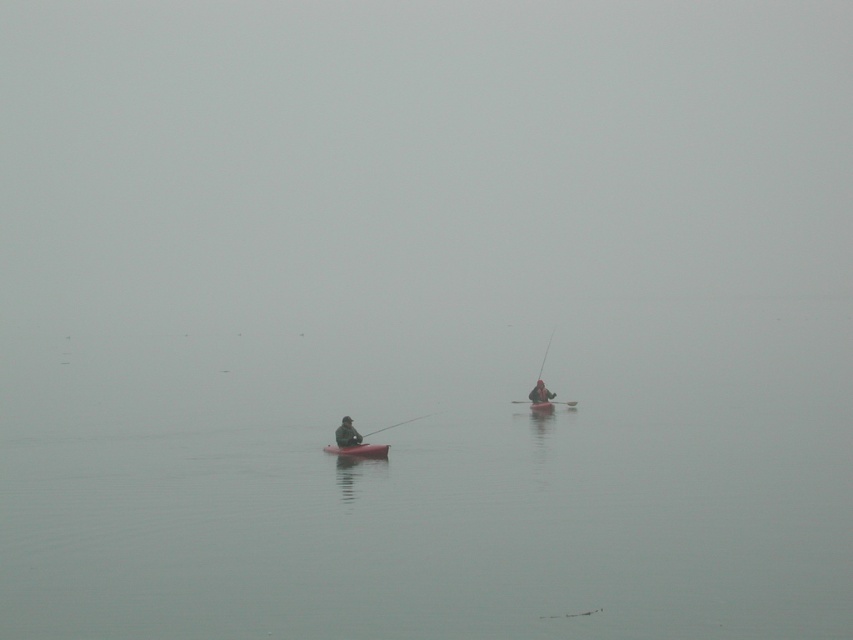
Question: Is smooth plastic rod at center closer to the viewer compared to smooth black fishing pole at center?

Choices:
 (A) yes
 (B) no

Answer: (A)

Question: Which of the following is the farthest from the observer?

Choices:
 (A) matte black kayak at center
 (B) smooth plastic paddle at center
 (C) smooth plastic rod at center
 (D) smooth red canoe at center

Answer: (A)

Question: Can you confirm if matte pink canoe at center is wider than smooth red canoe at center?

Choices:
 (A) no
 (B) yes

Answer: (B)

Question: Can you confirm if matte pink canoe at center is bigger than matte black kayak at center?

Choices:
 (A) yes
 (B) no

Answer: (A)

Question: Which of the following is the closest to the observer?

Choices:
 (A) smooth plastic paddle at center
 (B) matte black kayak at center

Answer: (A)

Question: Which of the following is the closest to the observer?

Choices:
 (A) (543, 400)
 (B) (540, 401)
 (C) (341, 438)
 (D) (549, 337)

Answer: (C)